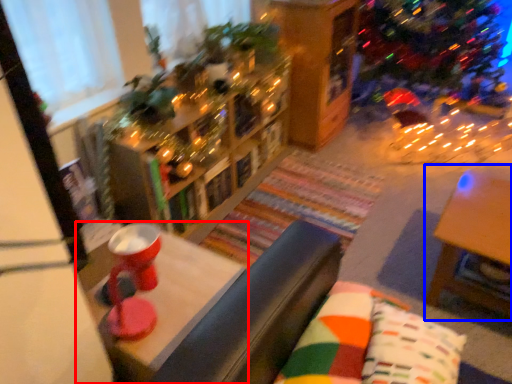
Question: Which object appears closest to the camera in this image, table (highlighted by a red box) or table (highlighted by a blue box)?

Choices:
 (A) table
 (B) table

Answer: (A)